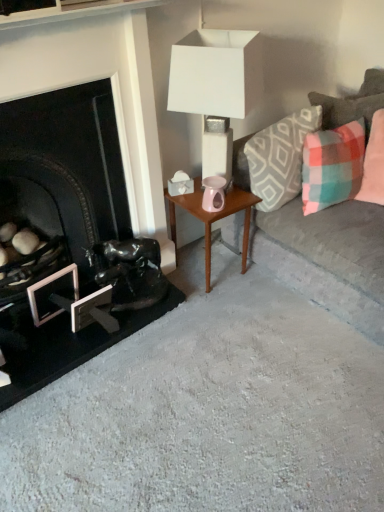
Question: From a real-world perspective, is plaid fabric pillow at right, the 3th pillow in the right-to-left sequence, physically below plush gray couch at right?

Choices:
 (A) yes
 (B) no

Answer: (B)

Question: Can you confirm if plaid fabric pillow at right, positioned as the first pillow in left-to-right order, is smaller than plush gray couch at right?

Choices:
 (A) no
 (B) yes

Answer: (B)

Question: Is plaid fabric pillow at right, the 3th pillow in the right-to-left sequence, oriented away from plush gray couch at right?

Choices:
 (A) no
 (B) yes

Answer: (B)

Question: Does plaid fabric pillow at right, the 3th pillow in the right-to-left sequence, appear on the right side of plush gray couch at right?

Choices:
 (A) no
 (B) yes

Answer: (A)

Question: Is plaid fabric pillow at right, positioned as the first pillow in left-to-right order, shorter than plush gray couch at right?

Choices:
 (A) no
 (B) yes

Answer: (B)

Question: Is plaid fabric pillow at right, the 3th pillow in the right-to-left sequence, outside of plush gray couch at right?

Choices:
 (A) no
 (B) yes

Answer: (A)

Question: Is the position of shiny black sculpture at lower left more distant than that of plaid fabric pillow at right, which is the first pillow in right-to-left order?

Choices:
 (A) no
 (B) yes

Answer: (B)

Question: Is shiny black sculpture at lower left closer to the viewer compared to plaid fabric pillow at right, which is the first pillow in right-to-left order?

Choices:
 (A) no
 (B) yes

Answer: (A)

Question: Does shiny black sculpture at lower left have a greater width compared to plaid fabric pillow at right, which is counted as the 3th pillow, starting from the left?

Choices:
 (A) no
 (B) yes

Answer: (A)

Question: Could plaid fabric pillow at right, which is counted as the 3th pillow, starting from the left, be considered to be inside shiny black sculpture at lower left?

Choices:
 (A) yes
 (B) no

Answer: (B)

Question: From the image's perspective, is shiny black sculpture at lower left on plaid fabric pillow at right, which is counted as the 3th pillow, starting from the left?

Choices:
 (A) no
 (B) yes

Answer: (A)

Question: From a real-world perspective, does shiny black sculpture at lower left sit lower than plaid fabric pillow at right, which is the first pillow in right-to-left order?

Choices:
 (A) yes
 (B) no

Answer: (A)

Question: From the image's perspective, does plaid fabric pillow at right, which is the first pillow in right-to-left order, appear lower than metallic silver picture frame at lower left?

Choices:
 (A) yes
 (B) no

Answer: (B)